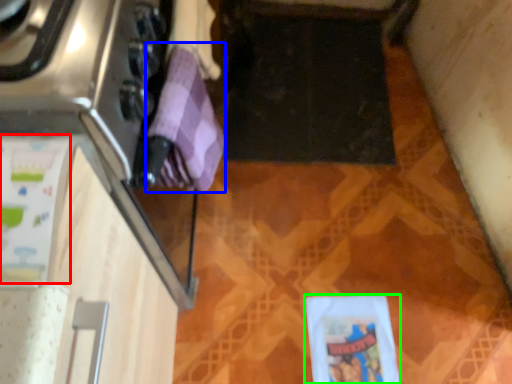
Question: Based on their relative distances, which object is farther from wrapping paper (highlighted by a red box)? Choose from wrapping paper (highlighted by a blue box) and wrapping paper (highlighted by a green box).

Choices:
 (A) wrapping paper
 (B) wrapping paper

Answer: (B)